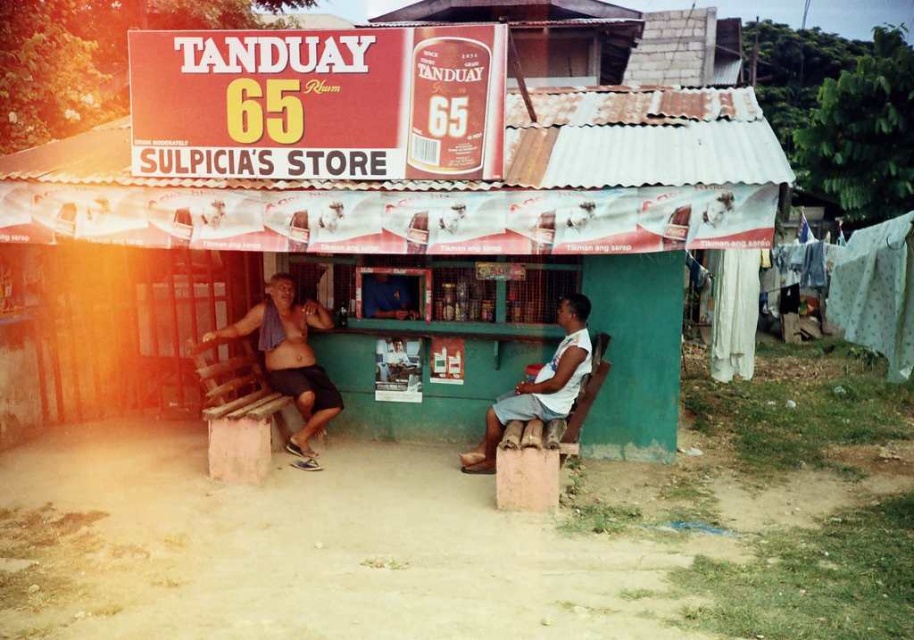
Consider the image. Which is above, shiny metallic towel at center or light brown wooden bench at lower right?

Positioned higher is shiny metallic towel at center.

Is shiny metallic towel at center to the right of light brown wooden bench at lower right from the viewer's perspective?

Incorrect, shiny metallic towel at center is not on the right side of light brown wooden bench at lower right.

Between point (314, 468) and point (577, 337), which one is positioned in front?

Point (577, 337) is more forward.

Find the location of `shiny metallic towel at center`. shiny metallic towel at center is located at coordinates (290, 358).